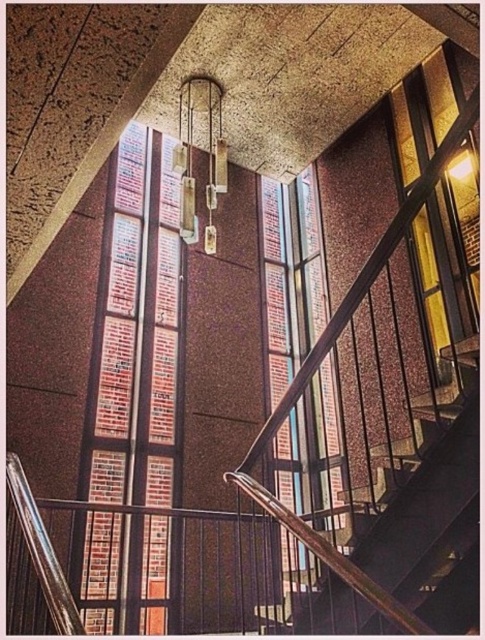
How far apart are brick-patterned glass window at left and clear glass window at center?

brick-patterned glass window at left is 5.26 feet from clear glass window at center.

Who is shorter, brick-patterned glass window at left or clear glass window at center?

With less height is clear glass window at center.

This screenshot has width=485, height=640. Find the location of `brick-patterned glass window at left`. brick-patterned glass window at left is located at coordinates (136, 333).